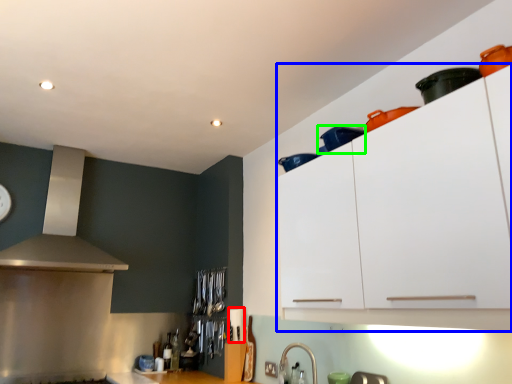
Question: Estimate the real-world distances between objects in this image. Which object is farther from appliance (highlighted by a red box), cabinetry (highlighted by a blue box) or appliance (highlighted by a green box)?

Choices:
 (A) cabinetry
 (B) appliance

Answer: (B)